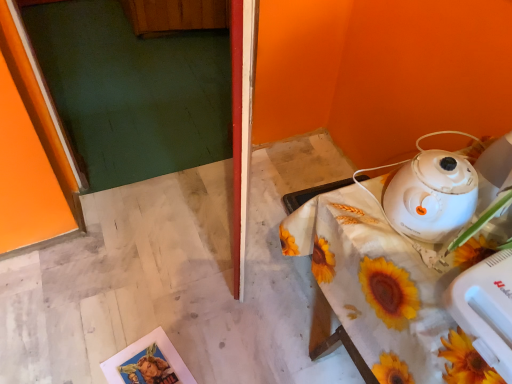
Question: Which is correct: white plastic mixer at lower right is inside white glossy kettle at upper right, or outside of it?

Choices:
 (A) outside
 (B) inside

Answer: (A)

Question: Is white plastic mixer at lower right wider or thinner than white glossy kettle at upper right?

Choices:
 (A) thin
 (B) wide

Answer: (B)

Question: Considering the real-world distances, which object is farthest from the white plastic mixer at lower right?

Choices:
 (A) white glossy kettle at upper right
 (B) white fabric-covered table at lower right

Answer: (A)

Question: Estimate the real-world distances between objects in this image. Which object is closer to the white fabric-covered table at lower right?

Choices:
 (A) white plastic mixer at lower right
 (B) white glossy kettle at upper right

Answer: (B)